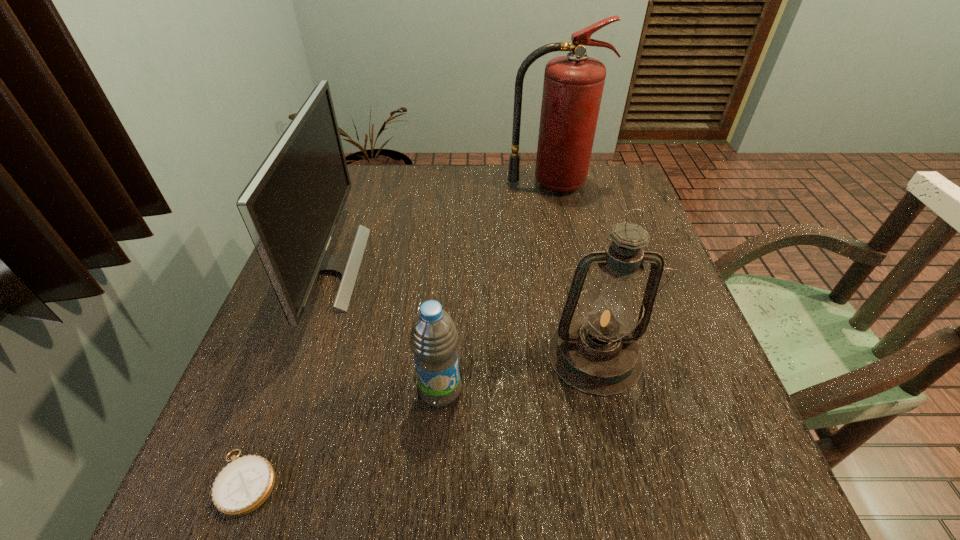
Locate an element on the screen. This screenshot has height=540, width=960. vacant space situated 0.160m on the left of the oil lamp is located at coordinates (468, 355).

Identify the location of vacant space located on the back of the second shortest object. (444, 347).

The width and height of the screenshot is (960, 540). I want to click on vacant space situated 0.360m on the back of the nearest object, so click(316, 295).

The width and height of the screenshot is (960, 540). What are the coordinates of `fire extinguisher situated at the far edge` in the screenshot? It's located at (573, 85).

Where is `monitor that is positioned at the far edge`? monitor that is positioned at the far edge is located at coordinates (291, 206).

Image resolution: width=960 pixels, height=540 pixels. Find the location of `object situated at the near edge`. object situated at the near edge is located at coordinates (242, 486).

Locate an element on the screen. This screenshot has width=960, height=540. monitor located in the left edge section of the desktop is located at coordinates (291, 206).

The height and width of the screenshot is (540, 960). Identify the location of compass that is positioned at the left edge. (242, 486).

You are a GUI agent. You are given a task and a screenshot of the screen. Output one action in this format:
    pyautogui.click(x=<x>, y=<y>)
    Task: Click on the fire extinguisher located at the right edge
    
    Given the screenshot: What is the action you would take?
    pyautogui.click(x=573, y=85)

At what (x,y) coordinates should I click in order to perform the action: click on oil lamp present at the right edge. Please return your answer as a coordinate pair (x, y). The width and height of the screenshot is (960, 540). Looking at the image, I should click on (597, 352).